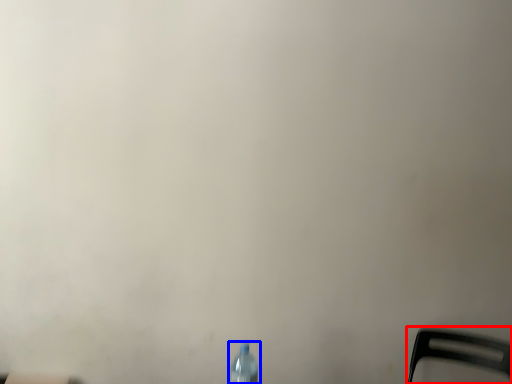
Question: Which object is further to the camera taking this photo, chair (highlighted by a red box) or bottle (highlighted by a blue box)?

Choices:
 (A) chair
 (B) bottle

Answer: (A)